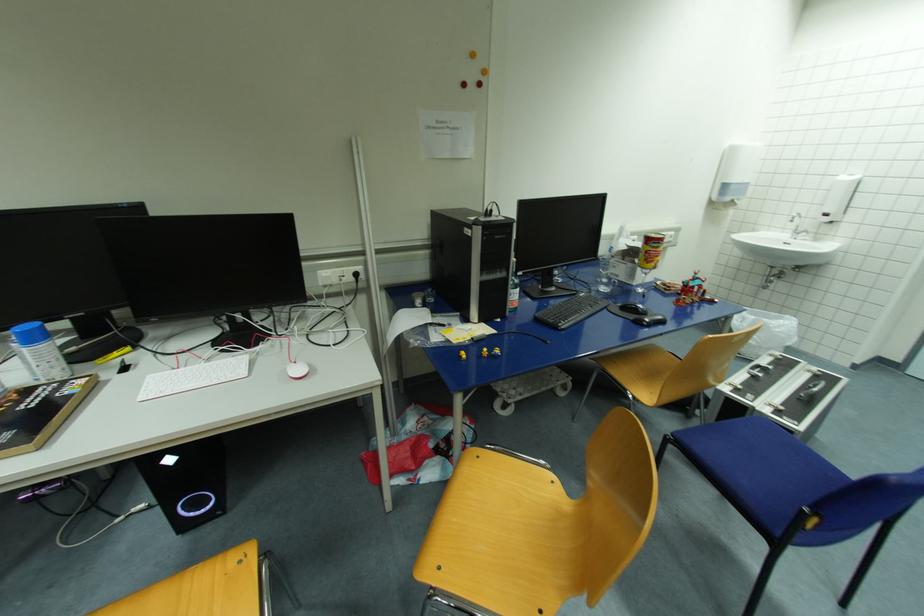
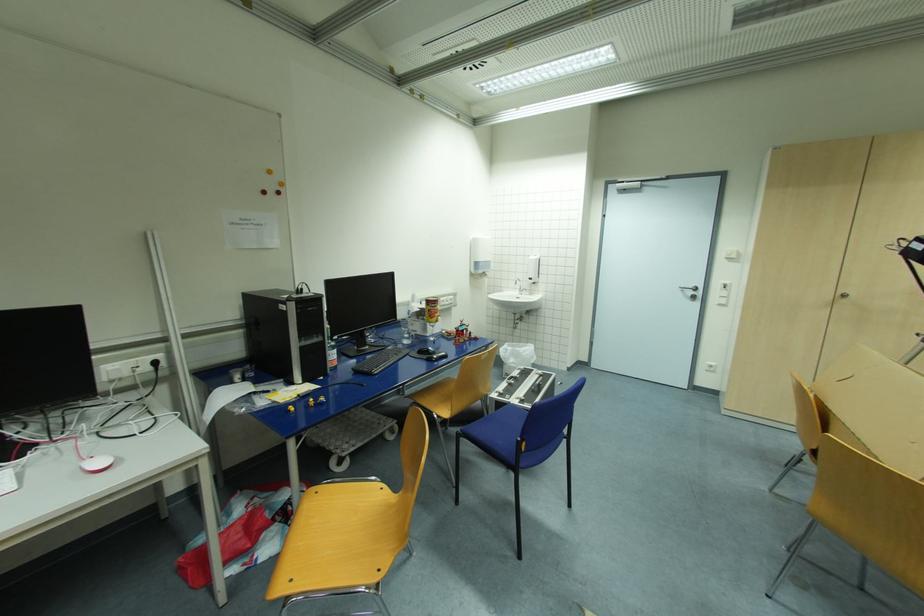
Question: I am providing you with two images of the same scene from different viewpoints. Which of the following objects are not visible in image2?

Choices:
 (A) metal cabinet knob
 (B) faucet handle
 (C) red computer mouse
 (D) none of these

Answer: (D)